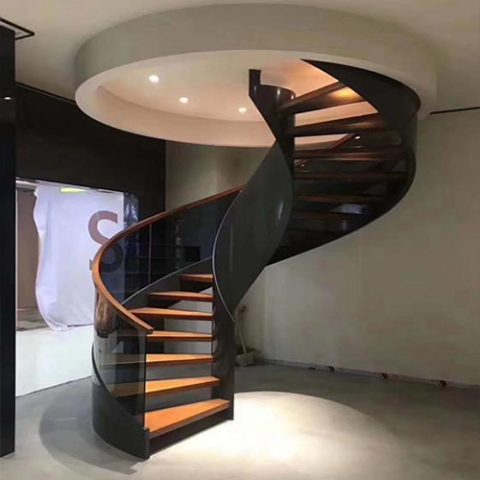
Locate an element on the screen. dark grey wall is located at coordinates (39, 128), (138, 172), (148, 202), (154, 346), (156, 324).